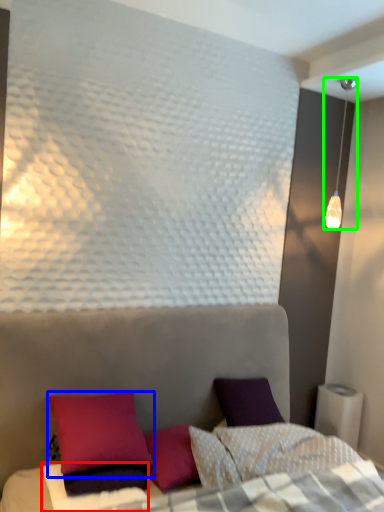
Question: Considering the real-world distances, which object is farthest from sheet (highlighted by a red box)? pillow (highlighted by a blue box) or lamp (highlighted by a green box)?

Choices:
 (A) pillow
 (B) lamp

Answer: (B)